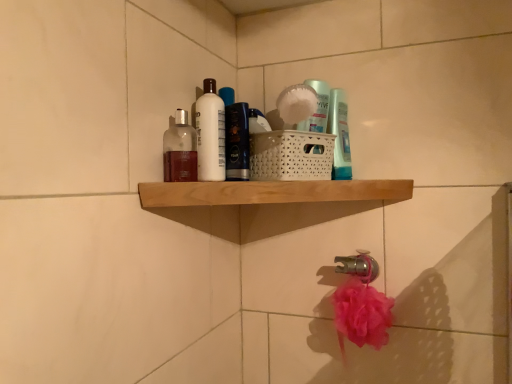
Question: Is wooden shelf at upper center to the left of translucent plastic bottle at upper center, which is the first toiletry from back to front, from the viewer's perspective?

Choices:
 (A) yes
 (B) no

Answer: (A)

Question: Does wooden shelf at upper center have a greater height compared to translucent plastic bottle at upper center, the 3th toiletry when ordered from front to back?

Choices:
 (A) yes
 (B) no

Answer: (B)

Question: From the image's perspective, would you say wooden shelf at upper center is shown under translucent plastic bottle at upper center, which is the first toiletry from back to front?

Choices:
 (A) yes
 (B) no

Answer: (A)

Question: Could you tell me if wooden shelf at upper center is facing translucent plastic bottle at upper center, acting as the third toiletry starting from the left?

Choices:
 (A) yes
 (B) no

Answer: (B)

Question: Can you confirm if wooden shelf at upper center is smaller than translucent plastic bottle at upper center, which is the first toiletry from back to front?

Choices:
 (A) no
 (B) yes

Answer: (A)

Question: Can you confirm if wooden shelf at upper center is wider than translucent plastic bottle at upper center, the 3th toiletry when ordered from front to back?

Choices:
 (A) yes
 (B) no

Answer: (A)

Question: Considering the relative sizes of translucent plastic bottle at upper center, acting as the third toiletry starting from the left, and white glossy bottle at upper center in the image provided, is translucent plastic bottle at upper center, acting as the third toiletry starting from the left, smaller than white glossy bottle at upper center?

Choices:
 (A) yes
 (B) no

Answer: (A)

Question: Considering the relative sizes of translucent plastic bottle at upper center, placed as the first toiletry when sorted from right to left, and white glossy bottle at upper center in the image provided, is translucent plastic bottle at upper center, placed as the first toiletry when sorted from right to left, wider than white glossy bottle at upper center?

Choices:
 (A) no
 (B) yes

Answer: (A)

Question: From the image's perspective, does translucent plastic bottle at upper center, placed as the first toiletry when sorted from right to left, appear lower than white glossy bottle at upper center?

Choices:
 (A) no
 (B) yes

Answer: (B)

Question: Can you confirm if translucent plastic bottle at upper center, acting as the third toiletry starting from the left, is shorter than white glossy bottle at upper center?

Choices:
 (A) yes
 (B) no

Answer: (A)

Question: Can you confirm if translucent plastic bottle at upper center, placed as the first toiletry when sorted from right to left, is bigger than white glossy bottle at upper center?

Choices:
 (A) yes
 (B) no

Answer: (B)

Question: Is translucent plastic bottle at upper center, the 3th toiletry when ordered from front to back, directly adjacent to white glossy bottle at upper center?

Choices:
 (A) yes
 (B) no

Answer: (B)

Question: From a real-world perspective, is translucent glass bottle at upper center, the 3th toiletry from the right, below translucent plastic bottle at upper center, placed as the first toiletry when sorted from right to left?

Choices:
 (A) yes
 (B) no

Answer: (A)